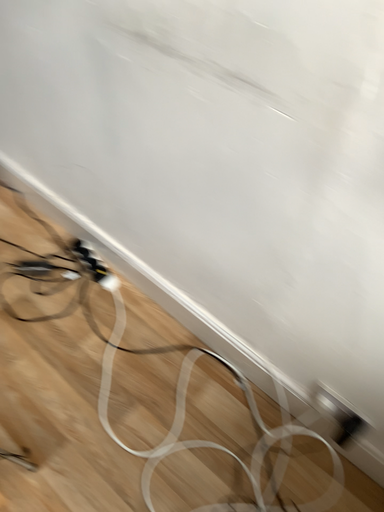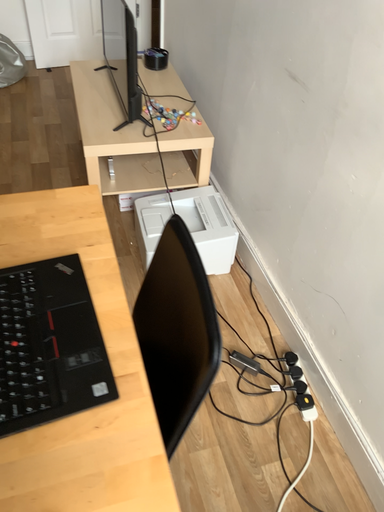
Question: How did the camera likely rotate when shooting the video?

Choices:
 (A) rotated right
 (B) rotated left

Answer: (B)